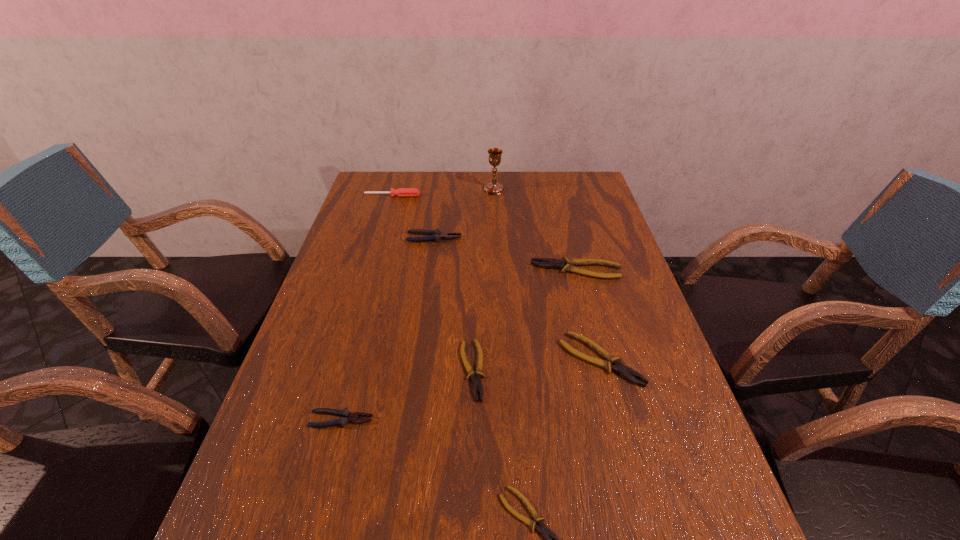
Locate which pliers is the fifth closest to the bigger gray pliers. Please provide its 2D coordinates. Your answer should be formatted as a tuple, i.e. [(x, y)], where the tuple contains the x and y coordinates of a point satisfying the conditions above.

[(541, 528)]

Identify which yellow pliers is the fourth closest to the third farthest object. Please provide its 2D coordinates. Your answer should be formatted as a tuple, i.e. [(x, y)], where the tuple contains the x and y coordinates of a point satisfying the conditions above.

[(541, 528)]

Image resolution: width=960 pixels, height=540 pixels. I want to click on yellow pliers that stands as the third closest to the nearest yellow pliers, so click(567, 265).

This screenshot has width=960, height=540. What are the coordinates of `vacant space that satisfies the following two spatial constraints: 1. at the gripping part of the sixth nearest object; 2. on the left side of the second farthest pliers` in the screenshot? It's located at (430, 270).

Where is `vacant area that satisfies the following two spatial constraints: 1. on the back side of the third pliers from left to right; 2. at the gripping part of the sixth nearest object`? vacant area that satisfies the following two spatial constraints: 1. on the back side of the third pliers from left to right; 2. at the gripping part of the sixth nearest object is located at coordinates [474, 238].

At what (x,y) coordinates should I click in order to perform the action: click on free space that satisfies the following two spatial constraints: 1. on the back side of the third smallest yellow pliers; 2. at the gripping part of the farther gray pliers. Please return your answer as a coordinate pair (x, y). This screenshot has height=540, width=960. Looking at the image, I should click on (569, 238).